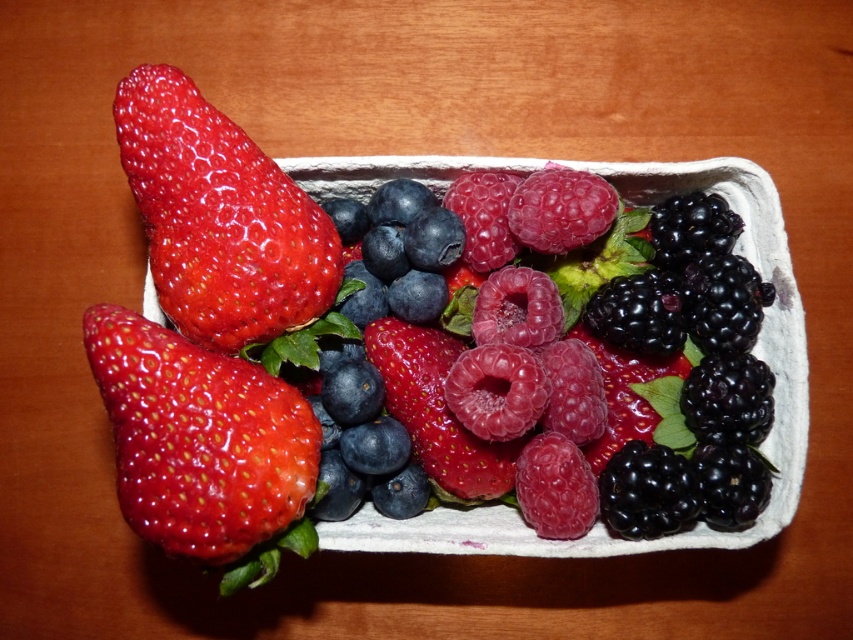
Is shiny red strawberry at lower left above glossy red strawberry at center?

No, shiny red strawberry at lower left is not above glossy red strawberry at center.

Is shiny red strawberry at lower left below glossy red strawberry at center?

Yes.

The width and height of the screenshot is (853, 640). What do you see at coordinates (204, 448) in the screenshot?
I see `shiny red strawberry at lower left` at bounding box center [204, 448].

The height and width of the screenshot is (640, 853). Identify the location of shiny red strawberry at lower left. (204, 448).

Is shiny red strawberry at upper left closer to camera compared to glossy red strawberry at center?

That is True.

From the picture: Can you confirm if shiny red strawberry at upper left is wider than glossy red strawberry at center?

Yes, shiny red strawberry at upper left is wider than glossy red strawberry at center.

I want to click on shiny red strawberry at upper left, so click(x=219, y=218).

This screenshot has height=640, width=853. Identify the location of shiny red strawberry at upper left. (219, 218).

Does point (160, 380) come behind point (125, 144)?

No, it is in front of (125, 144).

Which is behind, point (225, 376) or point (213, 200)?

Point (213, 200)

Identify the location of shiny red strawberry at lower left. This screenshot has height=640, width=853. (204, 448).